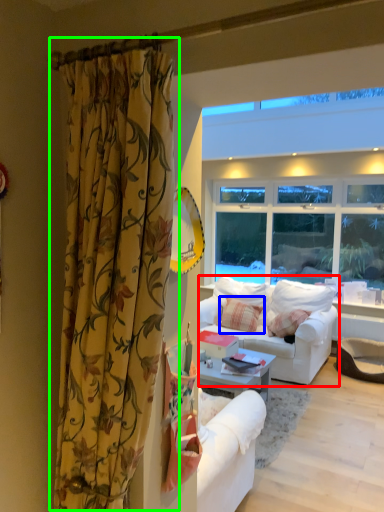
Question: Which object is positioned closest to studio couch (highlighted by a red box)? Select from pillow (highlighted by a blue box) and curtain (highlighted by a green box).

Choices:
 (A) pillow
 (B) curtain

Answer: (A)